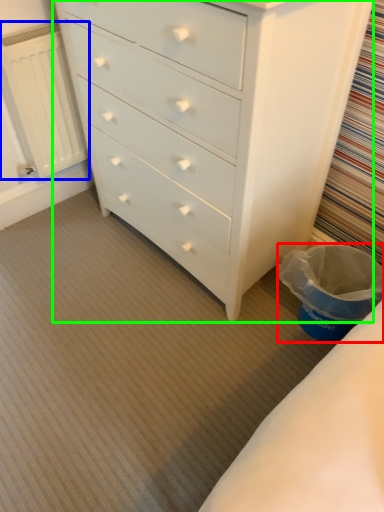
Question: Based on their relative distances, which object is nearer to laundry basket (highlighted by a red box)? Choose from radiator (highlighted by a blue box) and chest of drawers (highlighted by a green box).

Choices:
 (A) radiator
 (B) chest of drawers

Answer: (B)